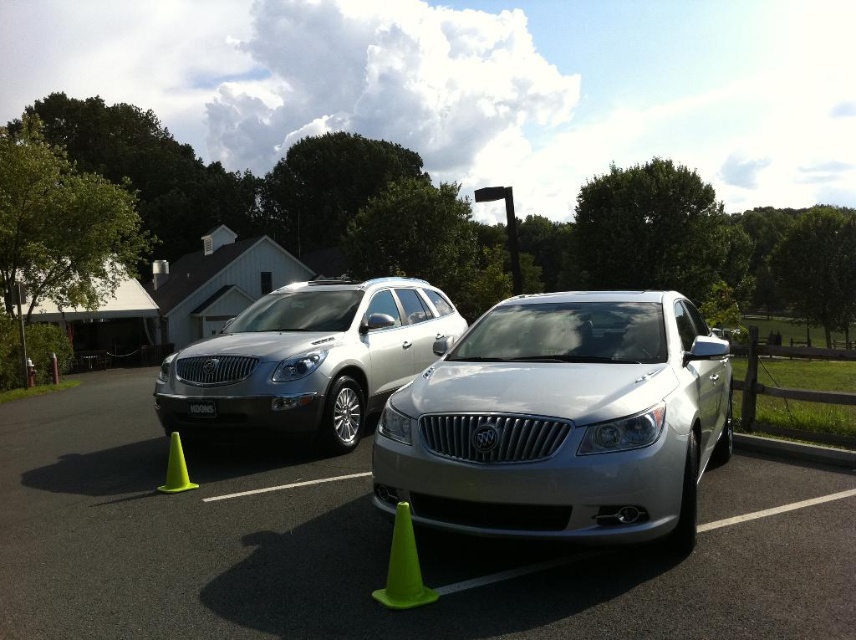
Question: Can you confirm if satin silver sedan at center is smaller than satin silver suv at center?

Choices:
 (A) yes
 (B) no

Answer: (A)

Question: Does satin silver car at center appear over satin silver suv at center?

Choices:
 (A) no
 (B) yes

Answer: (A)

Question: In this image, where is satin silver sedan at center located relative to black plastic license plate at center?

Choices:
 (A) below
 (B) above

Answer: (B)

Question: Which object appears closest to the camera in this image?

Choices:
 (A) green plastic cone at lower center
 (B) green plastic cone at lower left
 (C) satin silver suv at center

Answer: (A)

Question: Which of the following is the farthest from the observer?

Choices:
 (A) green plastic cone at lower center
 (B) satin silver suv at center
 (C) satin silver car at center
 (D) green plastic cone at lower left

Answer: (B)

Question: Estimate the real-world distances between objects in this image. Which object is farther from the satin silver sedan at center?

Choices:
 (A) satin silver car at center
 (B) satin silver suv at center
 (C) green plastic cone at lower center
 (D) green plastic cone at lower left

Answer: (D)